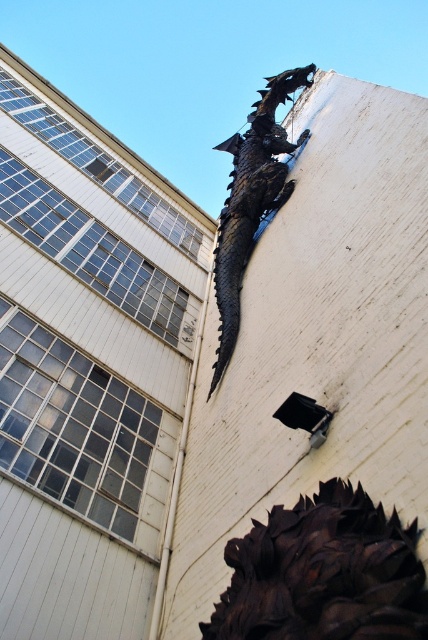
Does rusty metal dragon at upper right have a lesser height compared to dark matte metal dragon at upper center?

Indeed, rusty metal dragon at upper right has a lesser height compared to dark matte metal dragon at upper center.

Measure the distance between point (x=362, y=618) and camera.

The distance of point (x=362, y=618) from camera is 28.40 meters.

Locate an element on the screen. rusty metal dragon at upper right is located at coordinates (323, 573).